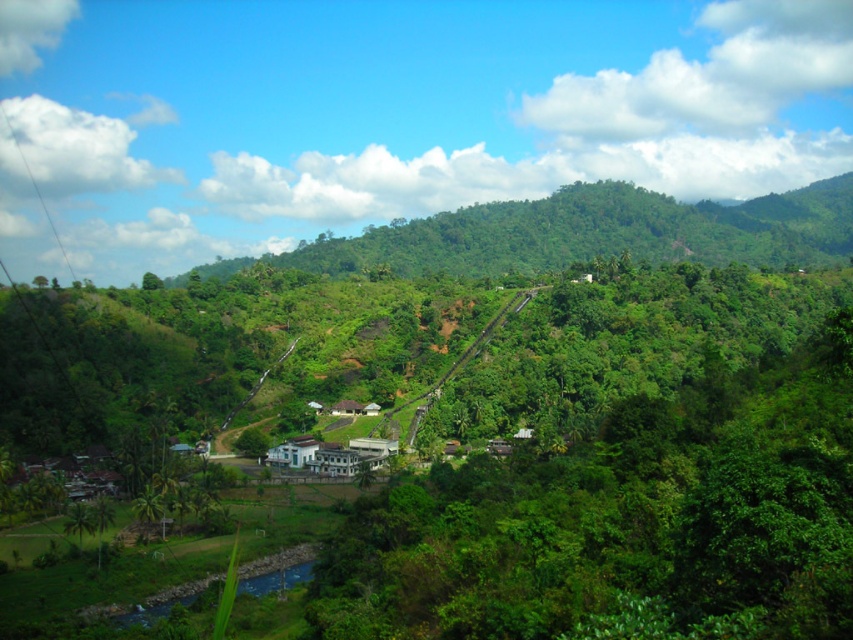
In the scene shown: You are planning to take a photo of the green leafy mountain at center and the white concrete building at center. Which object should you focus on first if you want to capture both in the same frame without moving the camera?

The green leafy mountain at center is bigger than the white concrete building at center, so you should focus on the green leafy mountain at center first to ensure it fills the frame appropriately before adjusting for the smaller building.

You are standing at the point with coordinates point (x=264, y=458) and want to reach the point with coordinates point (x=820, y=186). According to the scene description, will you have to walk through any obstacles like the dense greenery or the stream in the foreground?

Point (x=820, y=186) is behind point (x=264, y=458), so you will not have to walk through the dense greenery or the stream in the foreground to reach it.